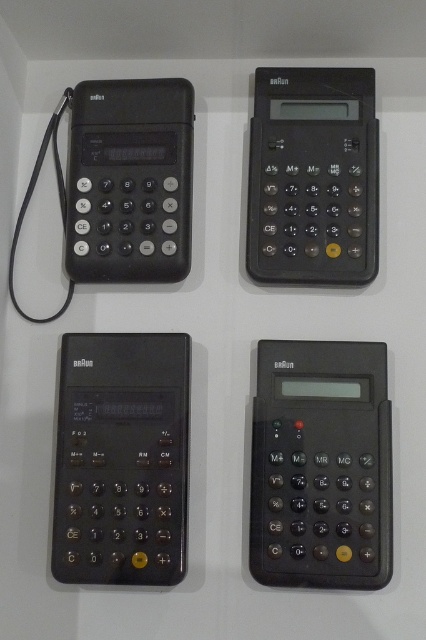
Question: Which point is closer to the camera?

Choices:
 (A) (359, 145)
 (B) (316, 385)
 (C) (117, 440)
 (D) (169, 160)

Answer: (C)

Question: Which point is closer to the camera taking this photo?

Choices:
 (A) (334, 529)
 (B) (299, 266)
 (C) (63, 492)

Answer: (A)

Question: Is black plastic calculator at upper right behind black matte calculator at upper left?

Choices:
 (A) yes
 (B) no

Answer: (B)

Question: Does black plastic calculator at bottom right have a smaller size compared to black matte calculator at upper left?

Choices:
 (A) yes
 (B) no

Answer: (B)

Question: Does black plastic calculator at bottom right appear over black plastic calculator at lower left?

Choices:
 (A) yes
 (B) no

Answer: (B)

Question: Estimate the real-world distances between objects in this image. Which object is farther from the black matte calculator at upper left?

Choices:
 (A) black plastic calculator at lower left
 (B) black plastic calculator at bottom right
 (C) black plastic calculator at upper right

Answer: (B)